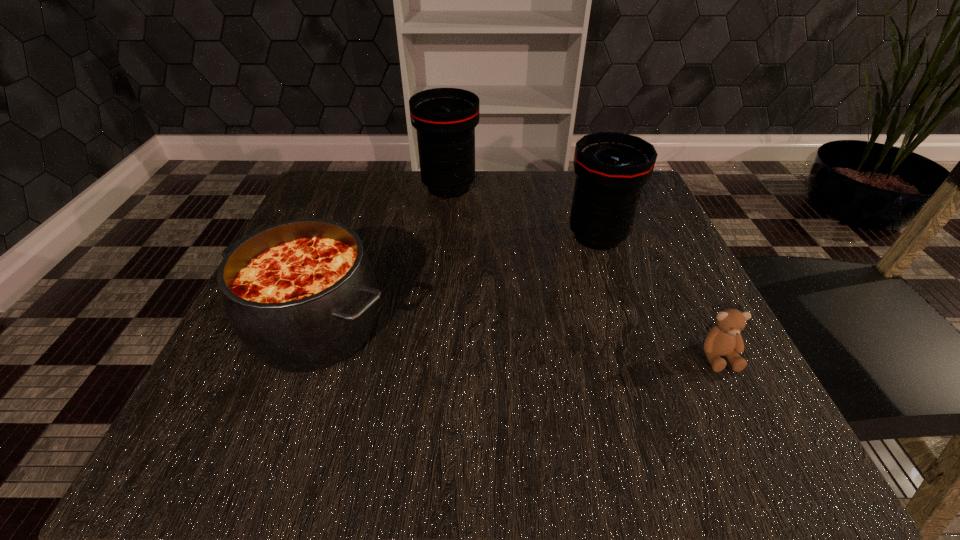
The image size is (960, 540). Find the location of `the left telephoto lens`. the left telephoto lens is located at coordinates [x=445, y=119].

Where is `the farthest object`? This screenshot has height=540, width=960. the farthest object is located at coordinates (445, 119).

You are a GUI agent. You are given a task and a screenshot of the screen. Output one action in this format:
    pyautogui.click(x=<x>, y=<y>)
    Task: Click on the second object from right to left
    The height and width of the screenshot is (540, 960).
    Given the screenshot: What is the action you would take?
    pyautogui.click(x=611, y=168)

This screenshot has width=960, height=540. What are the coordinates of `the right telephoto lens` in the screenshot? It's located at pyautogui.click(x=611, y=168).

The width and height of the screenshot is (960, 540). In order to click on casserole in this screenshot , I will do `click(301, 295)`.

Locate an element on the screen. teddy bear is located at coordinates (725, 339).

Where is `the shortest object`? This screenshot has height=540, width=960. the shortest object is located at coordinates (725, 339).

Find the location of a particular element. The width and height of the screenshot is (960, 540). free location located on the right of the farthest object is located at coordinates (644, 187).

Find the location of a particular element. free point located 0.320m on the front of the nearer telephoto lens is located at coordinates (x=655, y=409).

Locate an element on the screen. The height and width of the screenshot is (540, 960). free space located 0.110m on the back of the second shortest object is located at coordinates (347, 244).